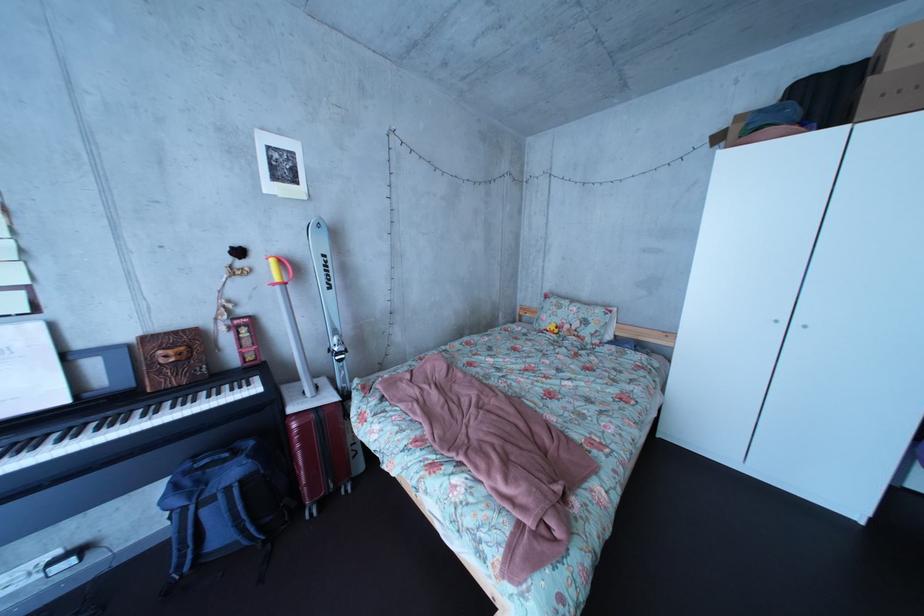
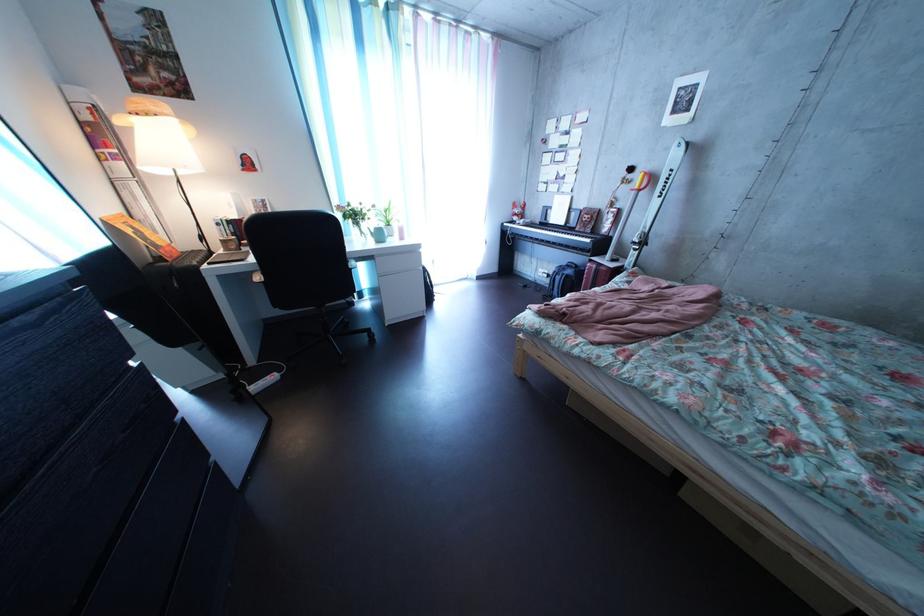
The point at (300, 292) is marked in the first image. Where is the corresponding point in the second image?

(653, 199)